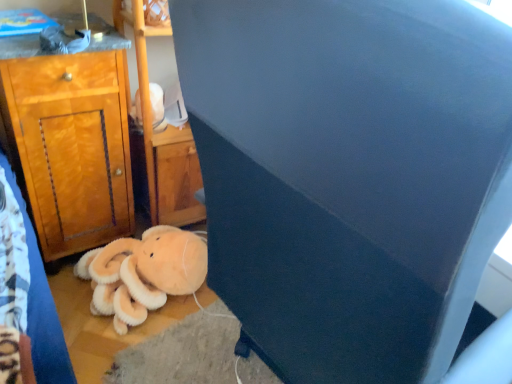
Question: Is wooden cabinet at left not within white plush toy at upper center?

Choices:
 (A) no
 (B) yes

Answer: (B)

Question: From the image's perspective, would you say wooden cabinet at left is positioned over white plush toy at upper center?

Choices:
 (A) no
 (B) yes

Answer: (A)

Question: Does wooden cabinet at left have a lesser width compared to white plush toy at upper center?

Choices:
 (A) yes
 (B) no

Answer: (B)

Question: Are wooden cabinet at left and white plush toy at upper center making contact?

Choices:
 (A) yes
 (B) no

Answer: (B)

Question: Is wooden cabinet at left at the left side of white plush toy at upper center?

Choices:
 (A) no
 (B) yes

Answer: (B)

Question: From a real-world perspective, is wooden cabinet at left located beneath white plush toy at upper center?

Choices:
 (A) yes
 (B) no

Answer: (A)

Question: Considering the relative positions of dark blue fabric at center and wooden cabinet at left in the image provided, is dark blue fabric at center to the left of wooden cabinet at left from the viewer's perspective?

Choices:
 (A) no
 (B) yes

Answer: (A)

Question: Is dark blue fabric at center behind wooden cabinet at left?

Choices:
 (A) yes
 (B) no

Answer: (B)

Question: From a real-world perspective, is dark blue fabric at center over wooden cabinet at left?

Choices:
 (A) yes
 (B) no

Answer: (A)

Question: Does dark blue fabric at center have a lesser height compared to wooden cabinet at left?

Choices:
 (A) yes
 (B) no

Answer: (B)

Question: Considering the relative sizes of dark blue fabric at center and wooden cabinet at left in the image provided, is dark blue fabric at center thinner than wooden cabinet at left?

Choices:
 (A) no
 (B) yes

Answer: (A)

Question: Considering the relative sizes of dark blue fabric at center and wooden cabinet at left in the image provided, is dark blue fabric at center wider than wooden cabinet at left?

Choices:
 (A) no
 (B) yes

Answer: (B)

Question: From a real-world perspective, does wooden cabinet at left sit lower than soft orange plush at lower left?

Choices:
 (A) yes
 (B) no

Answer: (B)